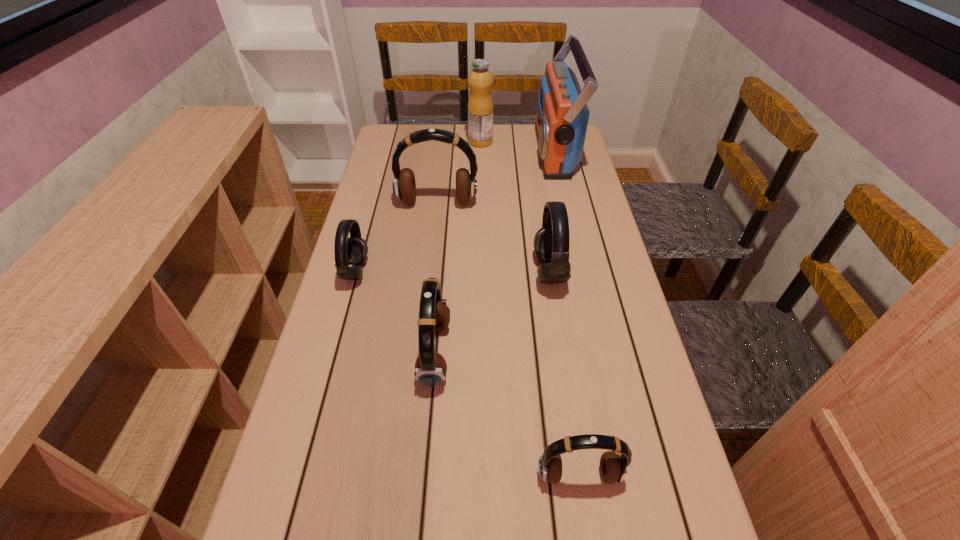
This screenshot has height=540, width=960. What are the coordinates of `the rightmost brown headset` in the screenshot? It's located at (613, 466).

The height and width of the screenshot is (540, 960). Identify the location of blank area located on the front-facing side of the radio receiver. (494, 151).

This screenshot has height=540, width=960. Identify the location of free space located on the front-facing side of the radio receiver. pos(442,151).

Find the location of `free point located 0.190m on the front-facing side of the radio receiver`. free point located 0.190m on the front-facing side of the radio receiver is located at coordinates (483, 151).

I want to click on vacant space located on the front label of the fruit juice, so click(444, 141).

Where is `vacant space located on the front label of the fruit juice`? This screenshot has width=960, height=540. vacant space located on the front label of the fruit juice is located at coordinates (409, 141).

Find the location of a particular element. The height and width of the screenshot is (540, 960). vacant space located 0.240m on the front label of the fruit juice is located at coordinates (404, 141).

This screenshot has width=960, height=540. I want to click on vacant space located on the ear cup of the biggest brown headset, so click(430, 269).

The height and width of the screenshot is (540, 960). Identify the location of free location located on the earcups of the right gray headset. (447, 272).

This screenshot has height=540, width=960. Identify the location of vacant area situated on the earcups of the right gray headset. (425, 272).